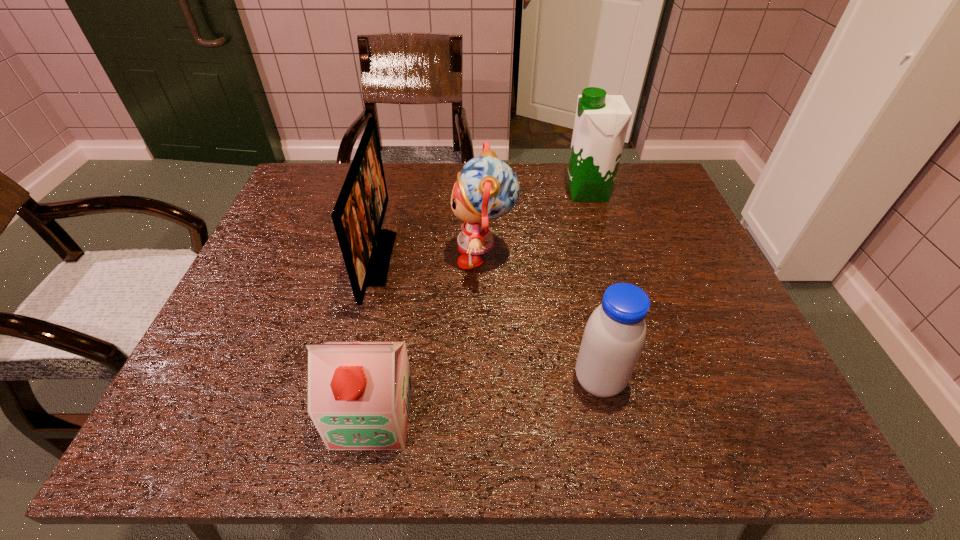
The height and width of the screenshot is (540, 960). Identify the location of vacant region between the leftmost soya milk and the monitor. (375, 336).

Identify the location of vacant point located between the farthest object and the third object from left to right. This screenshot has width=960, height=540. (536, 224).

I want to click on empty space between the farthest soya milk and the leftmost soya milk, so click(x=480, y=303).

Locate an element on the screen. This screenshot has height=540, width=960. empty space between the third object from left to right and the farthest soya milk is located at coordinates tap(536, 224).

Identify the location of vacant point located between the farthest object and the leftmost soya milk. The height and width of the screenshot is (540, 960). (480, 303).

Locate an element on the screen. empty space that is in between the doll and the farthest object is located at coordinates (536, 224).

You are a GUI agent. You are given a task and a screenshot of the screen. Output one action in this format:
    pyautogui.click(x=<x>, y=<y>)
    Task: Click on the second closest object to the leftmost soya milk
    This screenshot has height=540, width=960.
    Given the screenshot: What is the action you would take?
    pyautogui.click(x=487, y=188)

Identify the location of object that is the third nearest to the leftmost soya milk. This screenshot has width=960, height=540. (614, 336).

Select which soya milk is the third closest to the monitor. Please provide its 2D coordinates. Your answer should be formatted as a tuple, i.e. [(x, y)], where the tuple contains the x and y coordinates of a point satisfying the conditions above.

[(601, 122)]

Point out which soya milk is positioned as the nearest to the monitor. Please provide its 2D coordinates. Your answer should be formatted as a tuple, i.e. [(x, y)], where the tuple contains the x and y coordinates of a point satisfying the conditions above.

[(359, 393)]